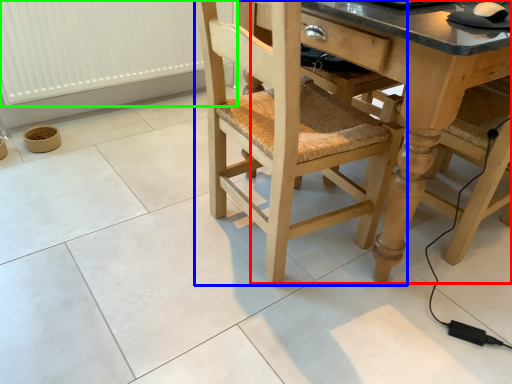
Question: Based on their relative distances, which object is nearer to counter top (highlighted by a red box)? Choose from chair (highlighted by a blue box) and radiator (highlighted by a green box).

Choices:
 (A) chair
 (B) radiator

Answer: (A)